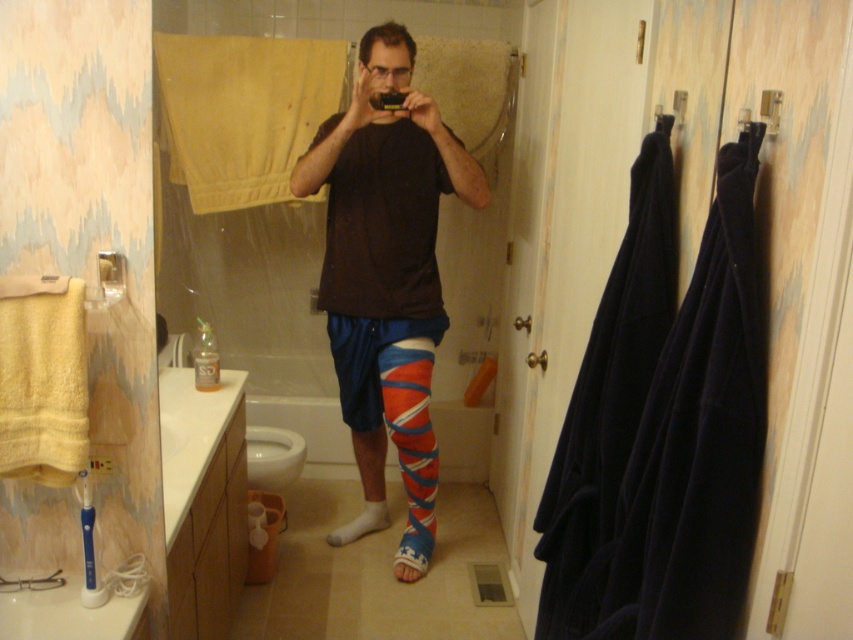
Question: Is matte blue shorts at center wider than white cotton sock at lower center?

Choices:
 (A) no
 (B) yes

Answer: (B)

Question: Is matte blue shorts at center smaller than white cotton sock at lower center?

Choices:
 (A) yes
 (B) no

Answer: (B)

Question: Does matte blue shorts at center appear over white cotton sock at lower center?

Choices:
 (A) yes
 (B) no

Answer: (A)

Question: Which of the following is the closest to the observer?

Choices:
 (A) matte blue shorts at center
 (B) white cotton sock at lower center

Answer: (A)